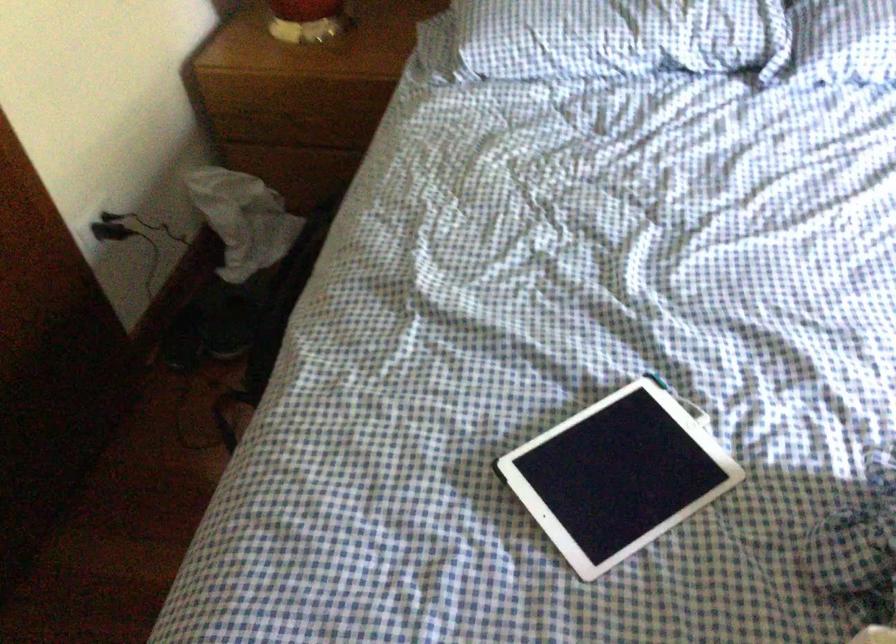
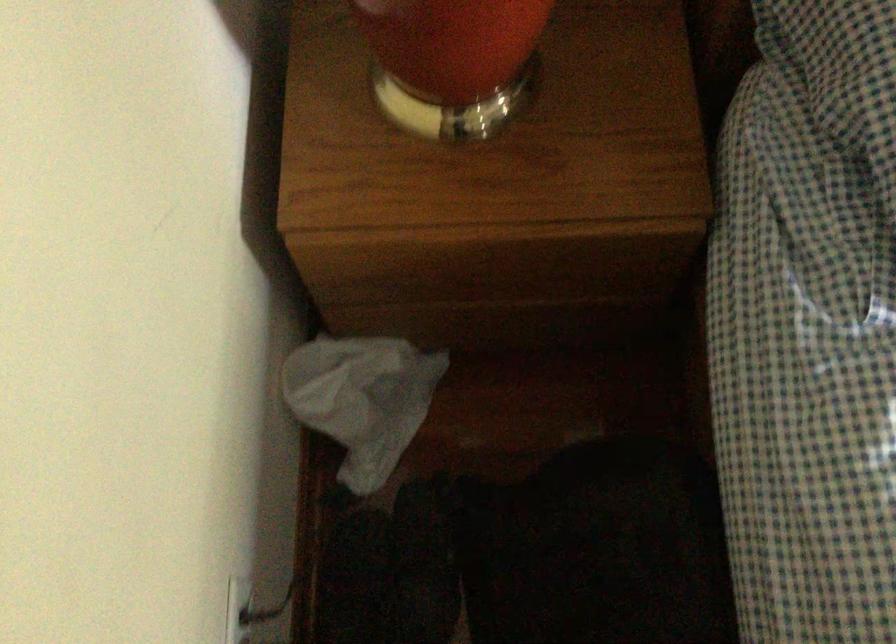
Which direction would the cameraman need to move to produce the second image?

The cameraman moved toward left, forward.